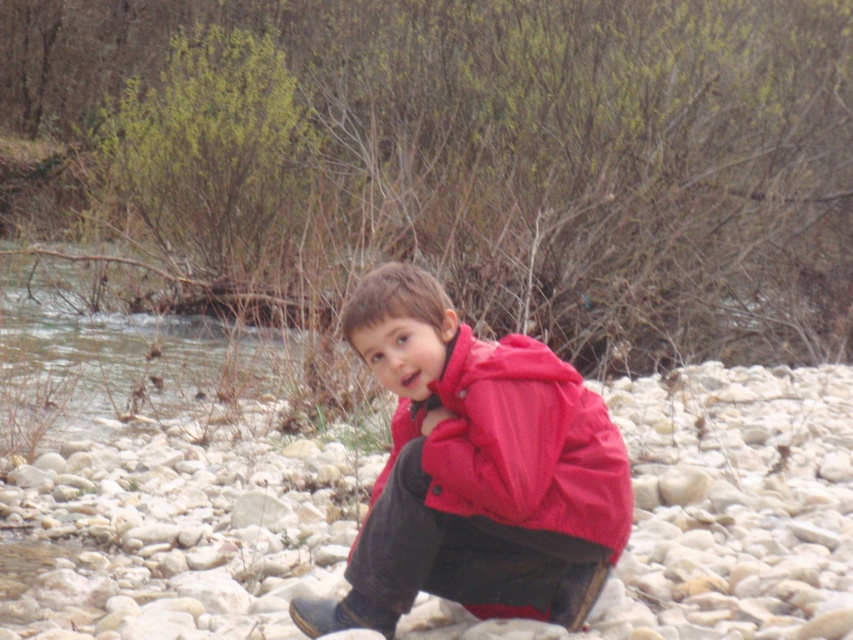
Question: Is the position of smooth pebbles at center less distant than that of matte red jacket at center?

Choices:
 (A) yes
 (B) no

Answer: (B)

Question: Which object is closer to the camera taking this photo?

Choices:
 (A) smooth pebbles at center
 (B) matte red jacket at center

Answer: (B)

Question: Which point is farther to the camera?

Choices:
 (A) (747, 522)
 (B) (618, 435)

Answer: (A)

Question: Is smooth pebbles at center further to the viewer compared to matte red jacket at center?

Choices:
 (A) yes
 (B) no

Answer: (A)

Question: Can you confirm if smooth pebbles at center is thinner than matte red jacket at center?

Choices:
 (A) no
 (B) yes

Answer: (A)